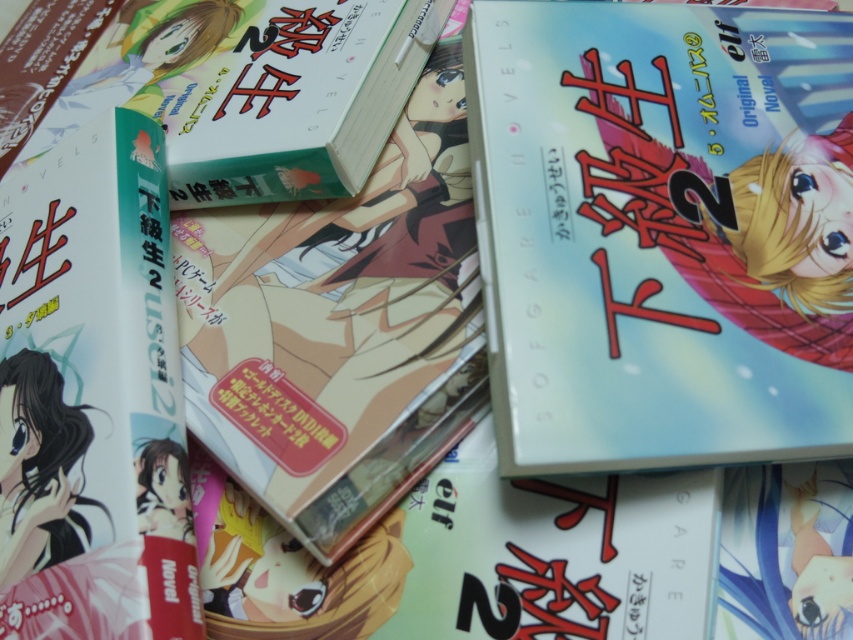
You are organizing a bookshelf and have two books to place. You have a matte blue novel at center and a hardcover book at upper left. Which book is taller?

The matte blue novel at center is taller than the hardcover book at upper left.

You are organizing a display of manga novels for a bookstore. You need to place a new sticker on the matte blue novel at center. According to the coordinates provided, where exactly should you place the sticker?

The sticker should be placed at the coordinates point (663, 230) where the matte blue novel at center is located.

You are organizing a bookshelf and need to place the matte blue novel at center and the hardcover novel at left. Which one should you place first to ensure they both fit on the shelf?

The matte blue novel at center is bigger than the hardcover novel at left. Therefore, you should place the matte blue novel at center first to ensure both fit on the shelf.